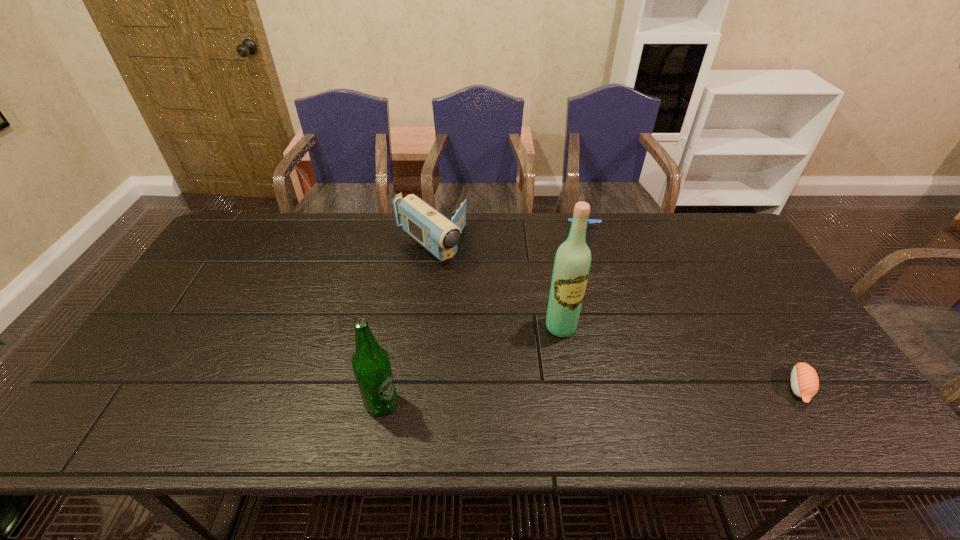
Where is `vacant space that's between the rightmost object and the second shortest object`? The width and height of the screenshot is (960, 540). vacant space that's between the rightmost object and the second shortest object is located at coordinates (692, 308).

I want to click on vacant space that's between the fourth shortest object and the camcorder, so click(406, 325).

Locate an element on the screen. vacant area that lies between the tallest object and the beer bottle is located at coordinates (471, 365).

You are a GUI agent. You are given a task and a screenshot of the screen. Output one action in this format:
    pyautogui.click(x=<x>, y=<y>)
    Task: Click on the free space between the third farthest object and the shortest object
    This screenshot has height=540, width=960.
    Given the screenshot: What is the action you would take?
    pyautogui.click(x=681, y=357)

This screenshot has width=960, height=540. Find the location of `free space between the fourth shortest object and the wine bottle`. free space between the fourth shortest object and the wine bottle is located at coordinates (471, 365).

Identify the location of free space between the camcorder and the second shortest object. (507, 237).

Locate an element on the screen. The width and height of the screenshot is (960, 540). free spot between the tallest object and the shortest object is located at coordinates (681, 357).

Identify which object is located as the nearest to the fourth object from left to right. Please provide its 2D coordinates. Your answer should be formatted as a tuple, i.e. [(x, y)], where the tuple contains the x and y coordinates of a point satisfying the conditions above.

[(436, 233)]

Point out which object is positioned as the second nearest to the third nearest object. Please provide its 2D coordinates. Your answer should be formatted as a tuple, i.e. [(x, y)], where the tuple contains the x and y coordinates of a point satisfying the conditions above.

[(590, 221)]

Where is `vacant point that satisfies the following two spatial constraints: 1. on the front side of the rightmost object; 2. on the right side of the Lego`? The width and height of the screenshot is (960, 540). vacant point that satisfies the following two spatial constraints: 1. on the front side of the rightmost object; 2. on the right side of the Lego is located at coordinates (629, 388).